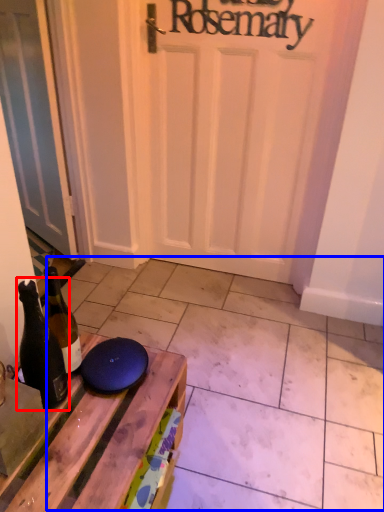
Question: Which object appears farthest to the camera in this image, bottle (highlighted by a red box) or tile (highlighted by a blue box)?

Choices:
 (A) bottle
 (B) tile

Answer: (B)